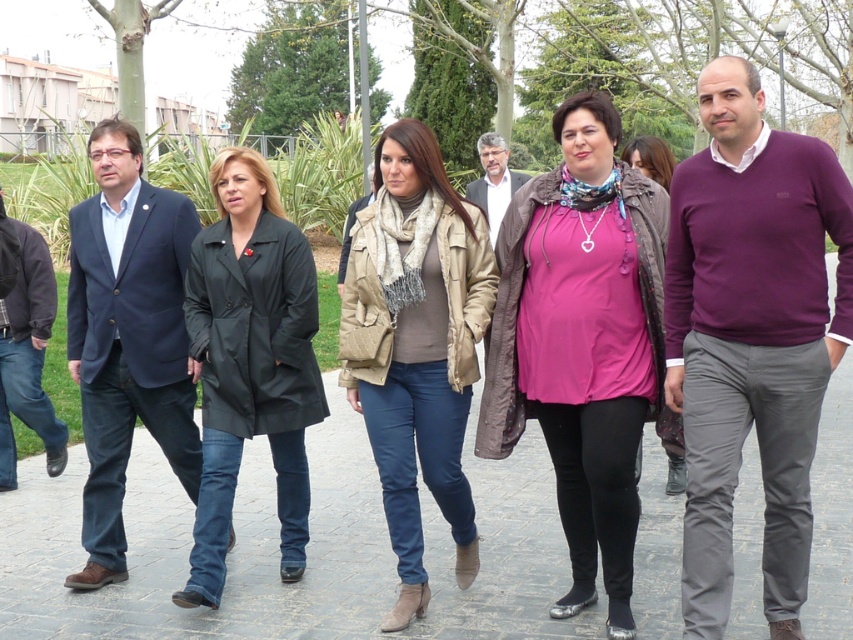
Question: Where is gray concrete pavement at center located in relation to dark gray suit at center in the image?

Choices:
 (A) above
 (B) below

Answer: (B)

Question: Where is gray concrete pavement at center located in relation to pink matte shirt at center in the image?

Choices:
 (A) below
 (B) above

Answer: (A)

Question: Based on their relative distances, which object is farther from the dark blue suit at left?

Choices:
 (A) gray concrete pavement at center
 (B) beige textured vest at center
 (C) pink matte shirt at center
 (D) purple sweater at center

Answer: (D)

Question: Among these points, which one is nearest to the camera?

Choices:
 (A) (38, 432)
 (B) (129, 390)
 (C) (657, 337)

Answer: (C)

Question: Does gray concrete pavement at center lie in front of dark gray suit at center?

Choices:
 (A) yes
 (B) no

Answer: (A)

Question: Which of the following is the closest to the observer?

Choices:
 (A) (15, 221)
 (B) (326, 593)

Answer: (B)